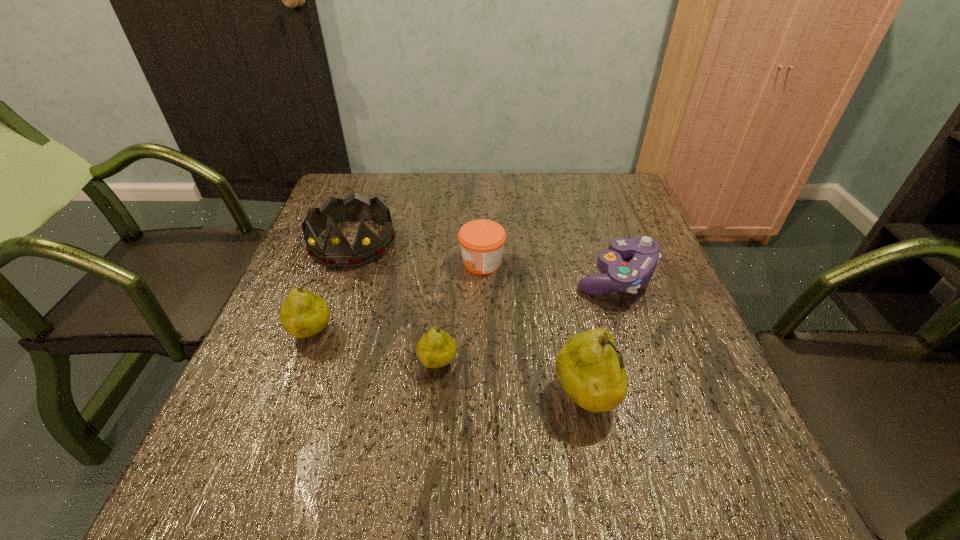
I want to click on vacant area situated 0.270m on the left of the tallest pear, so click(403, 399).

Find the location of a particular element. The image size is (960, 540). free region located 0.120m on the left of the control is located at coordinates (523, 276).

The width and height of the screenshot is (960, 540). I want to click on vacant area situated 0.250m on the front label of the jam, so click(x=357, y=262).

At what (x,y) coordinates should I click in order to perform the action: click on vacant space situated 0.220m on the front label of the jam. Please return your answer as a coordinate pair (x, y). Looking at the image, I should click on (370, 262).

The height and width of the screenshot is (540, 960). In order to click on free space located 0.230m on the front label of the jam in this screenshot , I will do click(365, 262).

At what (x,y) coordinates should I click in order to perform the action: click on vacant region located at the front of the tiara with jewels. Please return your answer as a coordinate pair (x, y). Looking at the image, I should click on (326, 318).

The width and height of the screenshot is (960, 540). In order to click on object at the near edge in this screenshot , I will do (590, 369).

What are the coordinates of `pear at the left edge` in the screenshot? It's located at (304, 313).

Where is `tiara positioned at the left edge`? The image size is (960, 540). tiara positioned at the left edge is located at coordinates (337, 252).

Where is `object located in the right edge section of the desktop`? object located in the right edge section of the desktop is located at coordinates (643, 252).